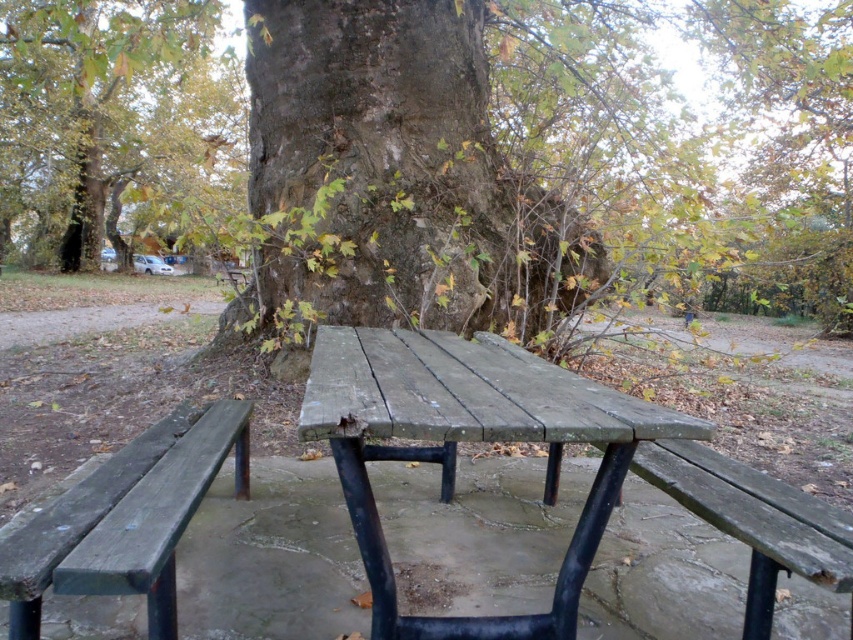
Question: Is green rough bark tree at upper left positioned before weathered wood bench at center?

Choices:
 (A) no
 (B) yes

Answer: (A)

Question: Is green rough bark tree at upper left smaller than weathered wood bench at center?

Choices:
 (A) no
 (B) yes

Answer: (A)

Question: Which of these objects is positioned closest to the weathered wood bench at lower left?

Choices:
 (A) weathered wood bench at center
 (B) green weathered wood picnic table at center
 (C) green rough bark tree at upper left
 (D) rough bark tree at center

Answer: (B)

Question: Which object is positioned farthest from the rough bark tree at center?

Choices:
 (A) weathered wood bench at lower left
 (B) green weathered wood picnic table at center

Answer: (A)

Question: Is green rough bark tree at upper left positioned in front of weathered wood bench at lower left?

Choices:
 (A) no
 (B) yes

Answer: (A)

Question: Which point appears farthest from the camera in this image?

Choices:
 (A) pyautogui.click(x=117, y=208)
 (B) pyautogui.click(x=712, y=481)

Answer: (A)